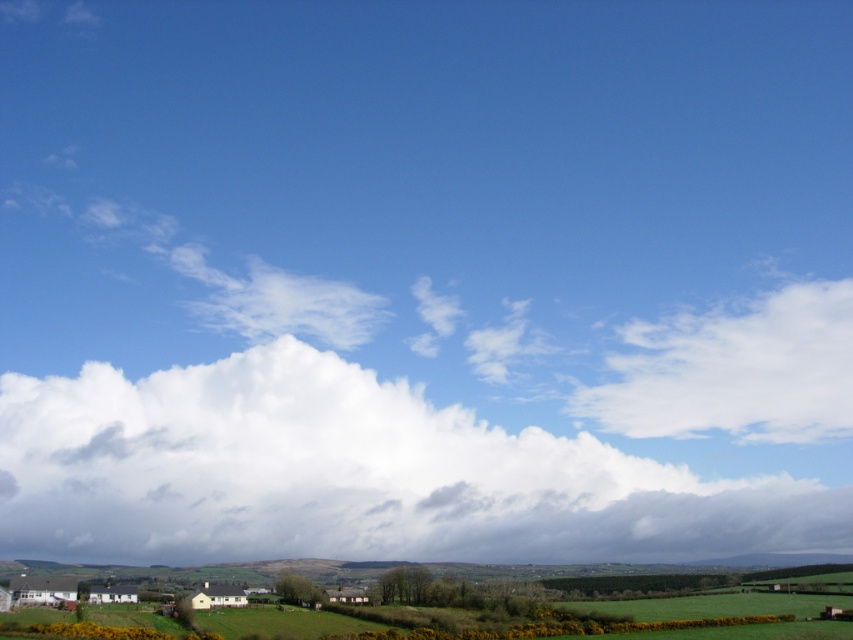
Consider the image. Between white fluffy cloud at center and white fluffy cloud at upper right, which one is positioned lower?

Positioned lower is white fluffy cloud at center.

This screenshot has width=853, height=640. I want to click on white fluffy cloud at center, so click(x=352, y=474).